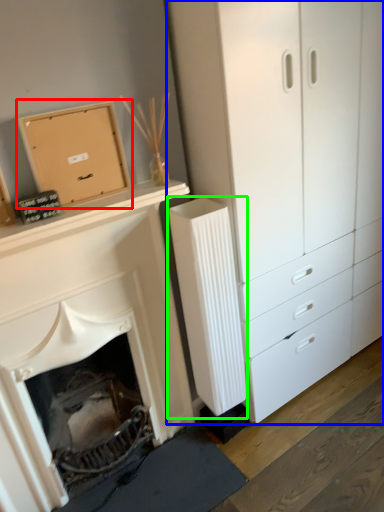
Question: Considering the real-world distances, which object is closest to cardboard box (highlighted by a red box)? chest of drawers (highlighted by a blue box) or radiator (highlighted by a green box).

Choices:
 (A) chest of drawers
 (B) radiator

Answer: (B)